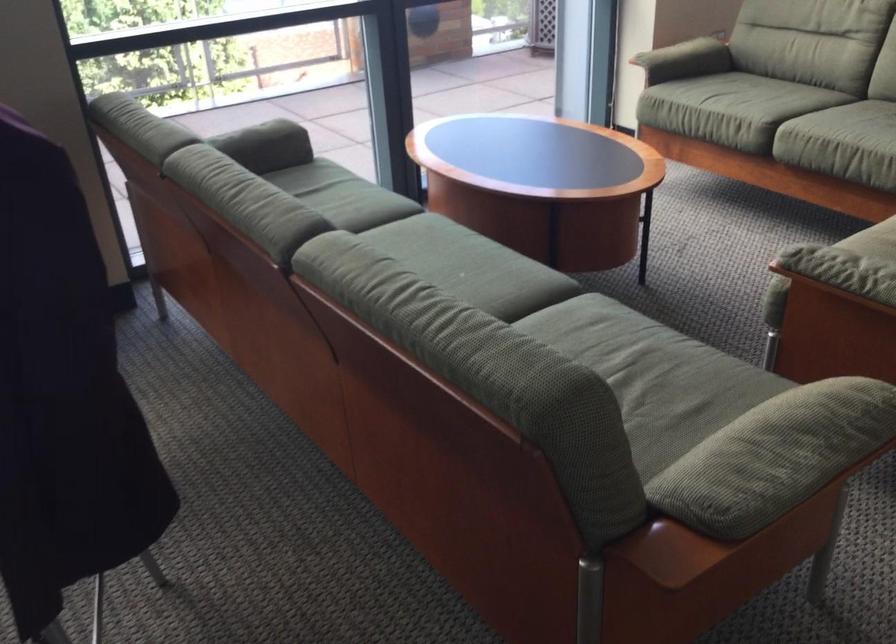
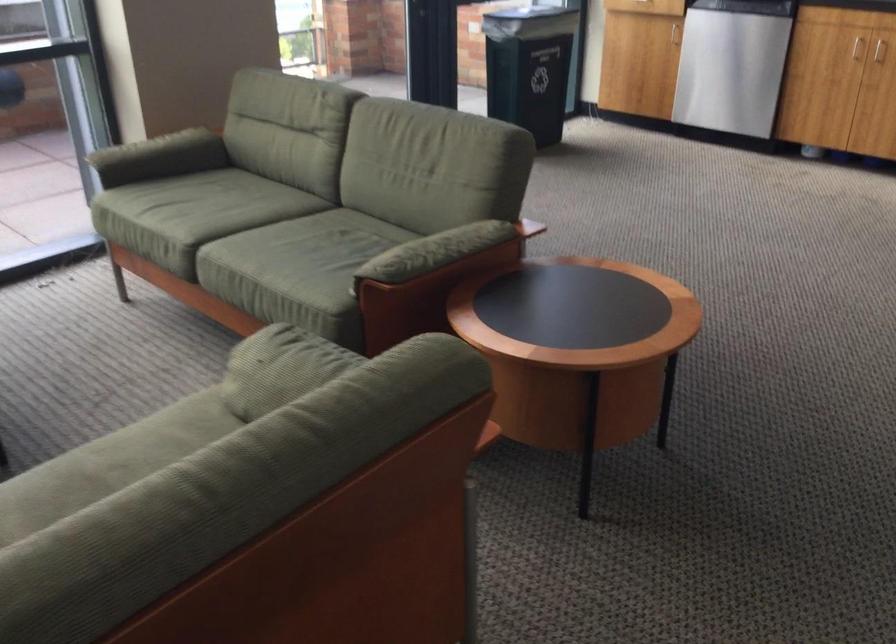
Question: Which direction would the cameraman need to move to produce the second image? Reply with the corresponding letter.

Choices:
 (A) Left
 (B) Right
 (C) Forward
 (D) Backward

Answer: (B)